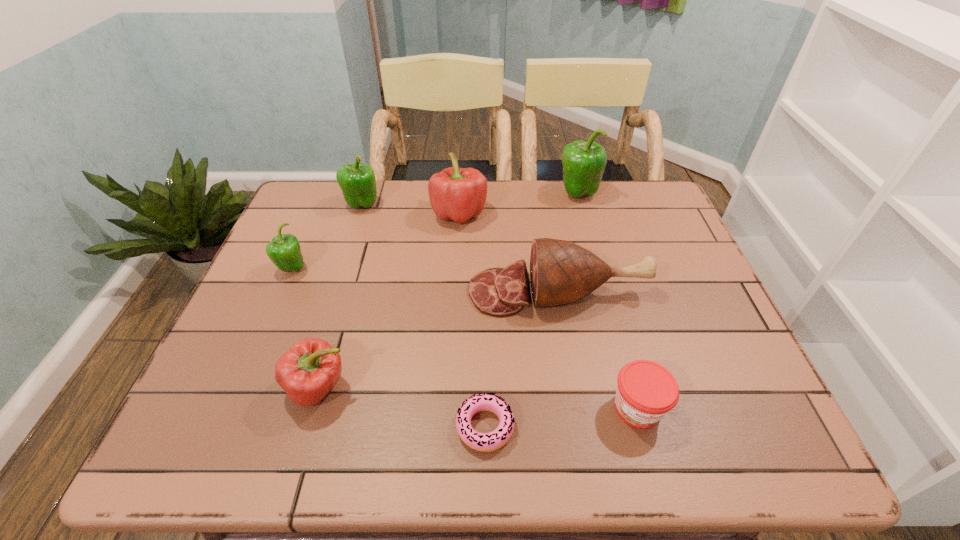
In order to click on the tallest object in this screenshot , I will do `click(584, 163)`.

The height and width of the screenshot is (540, 960). I want to click on the rightmost green bell pepper, so click(x=584, y=163).

What are the coordinates of `the second smallest green bell pepper` in the screenshot? It's located at (357, 181).

You are a GUI agent. You are given a task and a screenshot of the screen. Output one action in this format:
    pyautogui.click(x=<x>, y=<y>)
    Task: Click on the bigger pink bell pepper
    The width and height of the screenshot is (960, 540).
    Given the screenshot: What is the action you would take?
    pyautogui.click(x=458, y=194)

Locate an element on the screen. the farther pink bell pepper is located at coordinates (458, 194).

I want to click on ham, so click(561, 272).

The width and height of the screenshot is (960, 540). Find the location of `the leftmost object`. the leftmost object is located at coordinates (284, 250).

The height and width of the screenshot is (540, 960). What are the coordinates of `the second nearest bell pepper` in the screenshot? It's located at (284, 250).

Locate an element on the screen. the nearest bell pepper is located at coordinates (308, 371).

Locate an element on the screen. This screenshot has width=960, height=540. the smaller pink bell pepper is located at coordinates (308, 371).